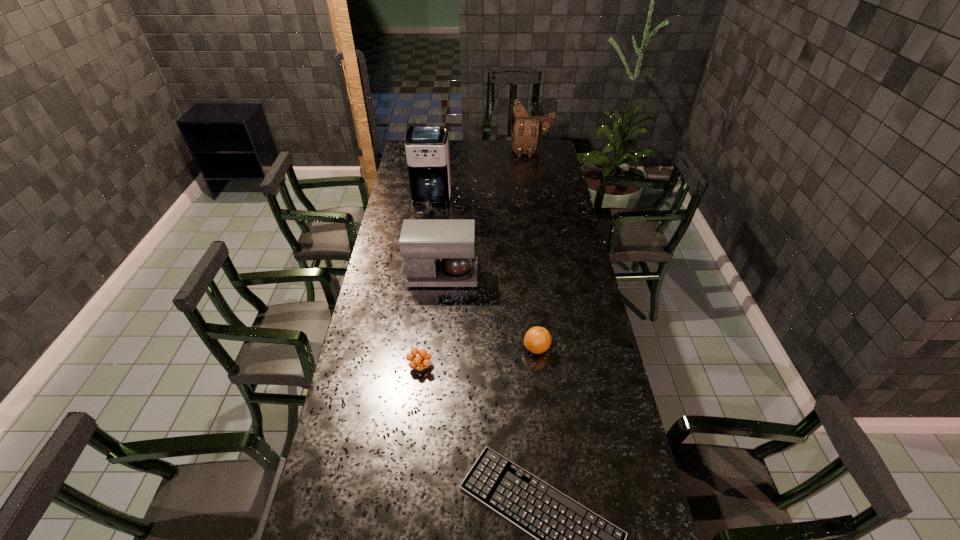
Find the location of a particular element. The image size is (960, 540). vacant area in the image that satisfies the following two spatial constraints: 1. on the front panel of the second shortest object; 2. on the right side of the taller coffee maker is located at coordinates (409, 366).